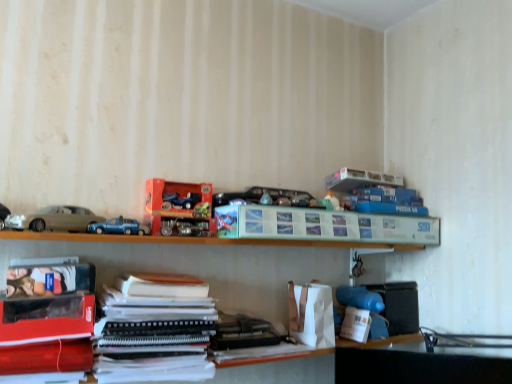
You are a GUI agent. You are given a task and a screenshot of the screen. Output one action in this format:
    pyautogui.click(x=<x>, y=<y>)
    Task: Click on the blue matte toy car at center
    This screenshot has width=512, height=384.
    Given the screenshot: What is the action you would take?
    pyautogui.click(x=118, y=227)

You are a GUI agent. You are given a task and a screenshot of the screen. Output one action in this format:
    pyautogui.click(x=<x>, y=<y>)
    Task: Click on the matte paper paperback book at center, arranged as the 2th paperback book when viewed from the front
    Image resolution: width=512 pixels, height=384 pixels.
    Given the screenshot: What is the action you would take?
    pyautogui.click(x=324, y=225)

What do you see at coordinates (324, 225) in the screenshot?
I see `matte paper paperback book at center, which is the 2th paperback book from left to right` at bounding box center [324, 225].

The width and height of the screenshot is (512, 384). What are the coordinates of `metallic car at center, the fifth toy viewed from the right` in the screenshot? It's located at (268, 197).

How much space does matte plastic toy car at center, which is counted as the 1th toy, starting from the top, occupy horizontally?

It is 2.48 inches.

What do you see at coordinates (206, 262) in the screenshot? This screenshot has width=512, height=384. I see `wooden shelf at lower center, placed as the 2th shelf when sorted from left to right` at bounding box center [206, 262].

Locate an element on the screen. The image size is (512, 384). wooden shelf at lower center, positioned as the first shelf in right-to-left order is located at coordinates (206, 262).

In order to face matte plastic toy at upper right, arranged as the 3th toy when viewed from the left, should I rotate leftwards or rightwards?

Turn right by 10.764 degrees to look at matte plastic toy at upper right, arranged as the 3th toy when viewed from the left.

Find the location of `blue matte toy car at center`. blue matte toy car at center is located at coordinates (118, 227).

Does white matte toy at lower right, the first toy in the bottom-to-top sequence, touch matte beige car at left, the 1th car positioned from the left?

No, white matte toy at lower right, the first toy in the bottom-to-top sequence, is not next to matte beige car at left, the 1th car positioned from the left.

Is white matte toy at lower right, placed as the second toy when sorted from right to left, to the left or to the right of matte beige car at left, the 1th car positioned from the left, in the image?

white matte toy at lower right, placed as the second toy when sorted from right to left, is to the right of matte beige car at left, the 1th car positioned from the left.

Do you think white matte toy at lower right, the first toy in the bottom-to-top sequence, is within matte beige car at left, the 1th car positioned from the left, or outside of it?

white matte toy at lower right, the first toy in the bottom-to-top sequence, is spatially situated outside matte beige car at left, the 1th car positioned from the left.

Who is taller, white matte toy at lower right, placed as the second toy when sorted from right to left, or matte beige car at left, which is the second car in right-to-left order?

With more height is matte beige car at left, which is the second car in right-to-left order.

Considering the points (382, 310) and (102, 326), which point is behind, point (382, 310) or point (102, 326)?

Positioned behind is point (382, 310).

Is blue rubber ball at lower center, the 5th toy positioned from the left, thinner than white paper stack at lower center?

Correct, the width of blue rubber ball at lower center, the 5th toy positioned from the left, is less than that of white paper stack at lower center.

From a real-world perspective, is blue rubber ball at lower center, the 5th toy positioned from the left, positioned above or below white paper stack at lower center?

Clearly, from a real-world perspective, blue rubber ball at lower center, the 5th toy positioned from the left, is above white paper stack at lower center.

Is blue rubber ball at lower center, the 1th toy from the right, positioned before white paper stack at lower center?

No, it is behind white paper stack at lower center.

Between matte black paperback book at lower left, acting as the 2th paperback book starting from the back, and white paper stack at lower center, which one appears on the right side from the viewer's perspective?

white paper stack at lower center is more to the right.

Where is `paperback book in front of the white paper stack at lower center`? This screenshot has height=384, width=512. paperback book in front of the white paper stack at lower center is located at coordinates (46, 319).

From a real-world perspective, relative to white paper stack at lower center, is matte black paperback book at lower left, which is counted as the first paperback book, starting from the bottom, vertically above or below?

From a real-world perspective, matte black paperback book at lower left, which is counted as the first paperback book, starting from the bottom, is physically above white paper stack at lower center.

Is matte black paperback book at lower left, which is counted as the first paperback book, starting from the bottom, positioned with its back to white paper stack at lower center?

No, matte black paperback book at lower left, which is counted as the first paperback book, starting from the bottom,'s orientation is not away from white paper stack at lower center.

Considering the sizes of objects matte paper paperback book at center, the 1th paperback book from the back, and matte beige car at left, the 1th car in the right-to-left sequence, in the image provided, who is taller, matte paper paperback book at center, the 1th paperback book from the back, or matte beige car at left, the 1th car in the right-to-left sequence,?

Standing taller between the two is matte paper paperback book at center, the 1th paperback book from the back.

Is matte paper paperback book at center, the 1th paperback book from the back, facing towards matte beige car at left, the 2th car from the left?

No, matte paper paperback book at center, the 1th paperback book from the back, is not facing towards matte beige car at left, the 2th car from the left.

Is there a large distance between matte paper paperback book at center, which ranks as the second paperback book in bottom-to-top order, and matte beige car at left, the 1th car in the right-to-left sequence?

matte paper paperback book at center, which ranks as the second paperback book in bottom-to-top order, is actually quite close to matte beige car at left, the 1th car in the right-to-left sequence.

Based on the photo, are white paper stack at lower center and metallic car at center, the fifth toy viewed from the right, located far from each other?

No.

Measure the distance between white paper stack at lower center and metallic car at center, arranged as the second toy when viewed from the top.

white paper stack at lower center is 17.97 inches from metallic car at center, arranged as the second toy when viewed from the top.

Considering the relative sizes of white paper stack at lower center and metallic car at center, arranged as the second toy when viewed from the top, in the image provided, is white paper stack at lower center wider than metallic car at center, arranged as the second toy when viewed from the top,?

Correct, the width of white paper stack at lower center exceeds that of metallic car at center, arranged as the second toy when viewed from the top.

From a real-world perspective, who is located lower, white paper stack at lower center or metallic car at center, which is the fourth toy in bottom-to-top order?

white paper stack at lower center.

Is matte black paperback book at lower left, acting as the 1th paperback book starting from the left, oriented towards blue matte toy car at center?

No.

Looking at this image, which is more to the left, matte black paperback book at lower left, acting as the 1th paperback book starting from the left, or blue matte toy car at center?

Positioned to the left is matte black paperback book at lower left, acting as the 1th paperback book starting from the left.

From the image's perspective, which object appears higher, matte black paperback book at lower left, the second paperback book viewed from the right, or blue matte toy car at center?

blue matte toy car at center, from the image's perspective.

Is matte black paperback book at lower left, which is counted as the first paperback book, starting from the bottom, positioned behind blue matte toy car at center?

No, matte black paperback book at lower left, which is counted as the first paperback book, starting from the bottom, is closer to the viewer.

Is white paper stack at lower center a part of matte beige car at left, which is the second car in right-to-left order?

Definitely not — white paper stack at lower center is not inside matte beige car at left, which is the second car in right-to-left order.

Is matte beige car at left, which is the second car in right-to-left order, touching white paper stack at lower center?

No, matte beige car at left, which is the second car in right-to-left order, is not in contact with white paper stack at lower center.

Does point (6, 224) appear closer or farther from the camera than point (139, 330)?

Point (6, 224).

The image size is (512, 384). Identify the location of the 2nd car to the left of the white paper stack at lower center, starting your count from the anchor. (10, 219).

Where is `toy that is the 2nd object located below the matte beige car at left, which is the second car in right-to-left order (from the image's perspective)`? The image size is (512, 384). toy that is the 2nd object located below the matte beige car at left, which is the second car in right-to-left order (from the image's perspective) is located at coordinates (362, 314).

Identify the location of magazine below the blue rubber ball at lower center, the 5th toy positioned from the left (from a real-world perspective). The image size is (512, 384). (154, 329).

Considering their positions, is matte plastic book at lower left, which is the 2th book from right to left, positioned closer to matte beige car at left, the 1th car positioned from the left, than black matte notebook at center, placed as the 1th book when sorted from bottom to top?

The object closer to matte beige car at left, the 1th car positioned from the left, is matte plastic book at lower left, which is the 2th book from right to left.

Based on their spatial positions, is matte plastic toy car at center, which appears as the fifth toy when ordered from the bottom, or matte plastic book at lower left, which is the second book in back-to-front order, further from wooden shelf at lower center, acting as the 1th shelf starting from the bottom?

Based on the image, matte plastic toy car at center, which appears as the fifth toy when ordered from the bottom, appears to be further to wooden shelf at lower center, acting as the 1th shelf starting from the bottom.

Estimate the real-world distances between objects in this image. Which object is further from black matte notebook at center, marked as the 2th book in a top-to-bottom arrangement, matte orange toy car set at center, positioned as the 2th shelf in right-to-left order, or matte plastic toy at upper right, the third toy when ordered from top to bottom?

matte plastic toy at upper right, the third toy when ordered from top to bottom, lies further to black matte notebook at center, marked as the 2th book in a top-to-bottom arrangement, than the other object.

In the scene shown: Which object lies nearer to the anchor point matte orange toy car set at center, marked as the second shelf in a bottom-to-top arrangement, matte plastic toy at upper right, the third toy when ordered from top to bottom, or matte black paperback book at lower left, acting as the 1th paperback book starting from the left?

The object closer to matte orange toy car set at center, marked as the second shelf in a bottom-to-top arrangement, is matte black paperback book at lower left, acting as the 1th paperback book starting from the left.

Looking at the image, which one is located closer to blue rubber ball at lower center, which is the second toy from bottom to top, matte plastic toy at upper right, the third toy when ordered from top to bottom, or matte plastic book at lower left, which is the 2th book from right to left?

matte plastic toy at upper right, the third toy when ordered from top to bottom, lies closer to blue rubber ball at lower center, which is the second toy from bottom to top, than the other object.

Consider the image. Looking at the image, which one is located further to matte beige car at left, which is the second car in right-to-left order, matte beige car at left, the 2th car from the left, or blue matte toy car at center?

Based on the image, blue matte toy car at center appears to be further to matte beige car at left, which is the second car in right-to-left order.

From the image, which object appears to be farther from white matte toy at lower right, placed as the second toy when sorted from right to left, blue matte toy car at center or white paper stack at lower center?

blue matte toy car at center lies further to white matte toy at lower right, placed as the second toy when sorted from right to left, than the other object.

Estimate the real-world distances between objects in this image. Which object is further from matte beige car at left, the 2th car from the left, matte plastic toy car at center, arranged as the 2th toy when viewed from the left, or matte plastic toy at upper right, the third toy positioned from the bottom?

matte plastic toy at upper right, the third toy positioned from the bottom, lies further to matte beige car at left, the 2th car from the left, than the other object.

Find the location of a particular element. Image resolution: width=512 pixels, height=384 pixels. book between matte beige car at left, the 2th car from the left, and matte black paperback book at lower left, acting as the 2th paperback book starting from the back, vertically is located at coordinates (50, 282).

The height and width of the screenshot is (384, 512). I want to click on magazine between blue matte toy car at center and matte plastic toy car at center, which appears as the fifth toy when ordered from the bottom, so click(154, 329).

At what (x,y) coordinates should I click in order to perform the action: click on car between matte plastic book at lower left, marked as the first book in a top-to-bottom arrangement, and matte orange toy car set at center, which appears as the first shelf when viewed from the left, in the horizontal direction. Please return your answer as a coordinate pair (x, y). Looking at the image, I should click on (61, 219).

This screenshot has height=384, width=512. I want to click on model car located between matte plastic book at lower left, the 1th book viewed from the front, and blue rubber ball at lower center, the 4th toy viewed from the top, in the left-right direction, so click(118, 227).